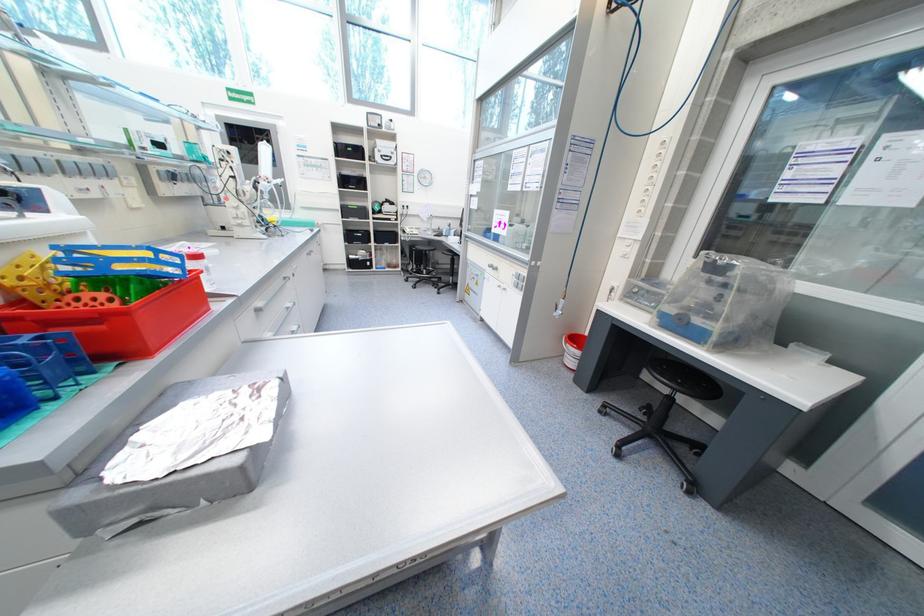
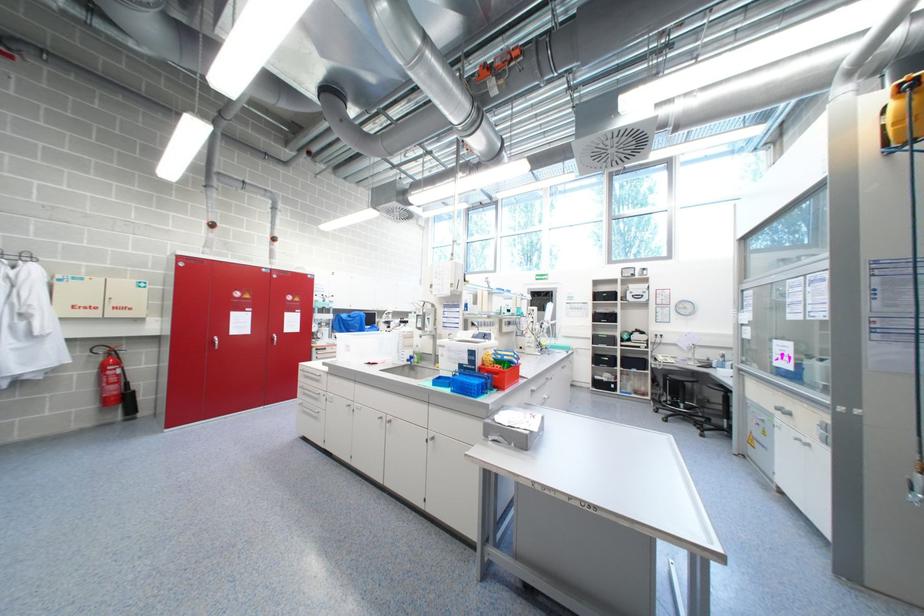
How did the camera likely rotate?

The rotation direction of the camera is left-up.